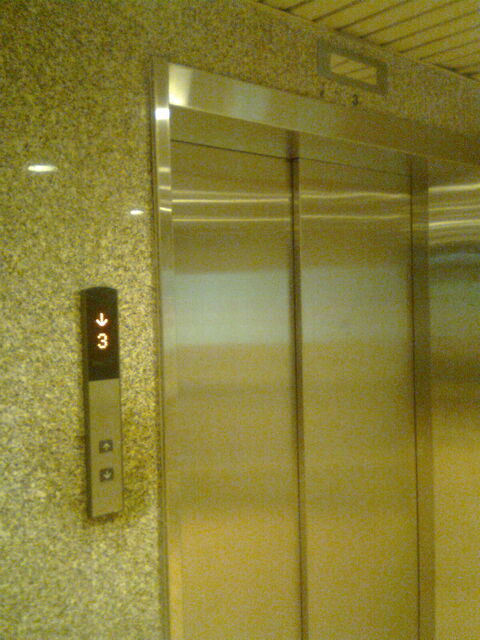
Locate an element on the screen. The height and width of the screenshot is (640, 480). wall is located at coordinates (87, 208).